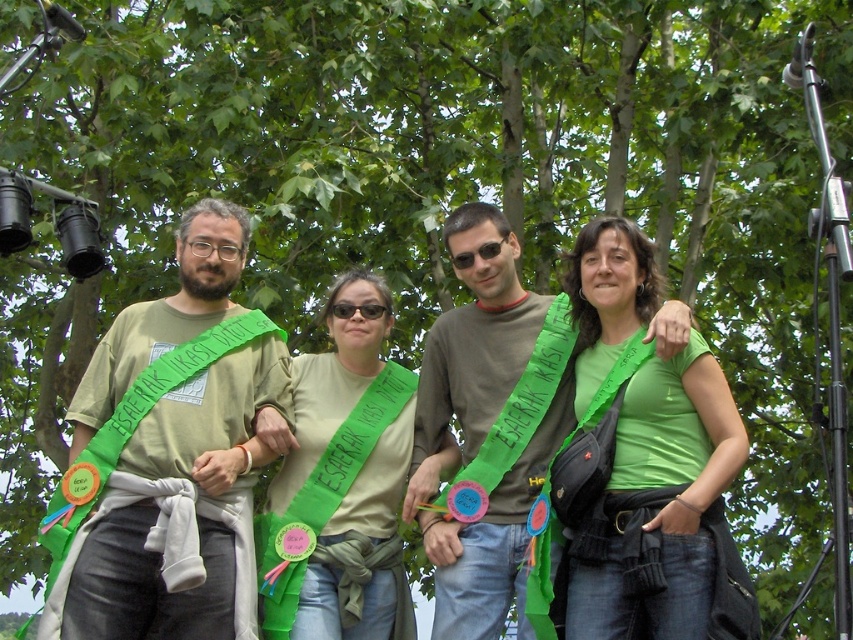
Between point (183, 529) and point (456, 356), which one is positioned behind?

Point (456, 356)

Which is more to the left, matte green sash at left or matte brown shirt at center?

Positioned to the left is matte green sash at left.

This screenshot has width=853, height=640. What do you see at coordinates (177, 513) in the screenshot?
I see `matte green sash at left` at bounding box center [177, 513].

Locate an element on the screen. This screenshot has width=853, height=640. matte green sash at left is located at coordinates (177, 513).

Can you confirm if green matte shirt at center is bigger than green fabric sash at center?

Yes, green matte shirt at center is bigger than green fabric sash at center.

Is point (706, 356) positioned behind point (344, 438)?

No, it is not.

At what (x,y) coordinates should I click in order to perform the action: click on green matte shirt at center. Please return your answer as a coordinate pair (x, y). Looking at the image, I should click on pos(645,465).

Can you confirm if matte green sash at left is thinner than green matte shirt at center?

No.

Does matte green sash at left have a lesser height compared to green matte shirt at center?

Indeed, matte green sash at left has a lesser height compared to green matte shirt at center.

Between point (184, 480) and point (688, 369), which one is positioned behind?

The point (184, 480) is more distant.

Where is `matte green sash at left`? The width and height of the screenshot is (853, 640). matte green sash at left is located at coordinates (177, 513).